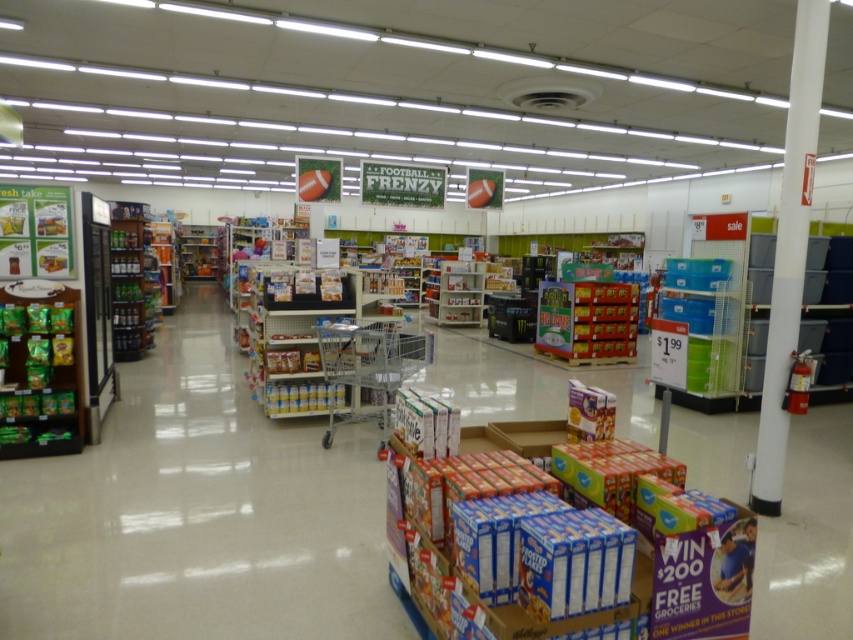
You are a grocery store employee who needs to restock the shelves. You have a shelf that can only hold items up to the size of the metallic silver beverage at left. Can you place the matte cardboard cereal boxes at center on this shelf?

The matte cardboard cereal boxes at center are larger in size than the metallic silver beverage at left, so they cannot be placed on the shelf designed for items up to the size of the metallic silver beverage at left.

You are a store employee who needs to restock the shelves. You have a shelf that can hold items up to 1 meter in width. You have the matte cardboard cereal boxes at center and the metallic silver beverage at left. Which item should you place on the shelf first to maximize space usage?

The matte cardboard cereal boxes at center might be wider than metallic silver beverage at left, so placing the cereal boxes first would allow the beverage to fit alongside if there is remaining space, maximizing the shelf width usage.

You are a customer in the grocery store aisle. You see the green matte snack at left and the metallic silver beverage at left. Which one is positioned lower on the shelf?

The green matte snack at left is located below the metallic silver beverage at left, so it is positioned lower on the shelf.